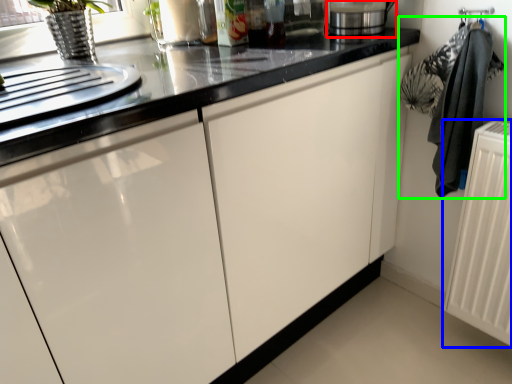
Question: Which object is positioned farthest from appliance (highlighted by a red box)? Select from radiator (highlighted by a blue box) and laundry (highlighted by a green box).

Choices:
 (A) radiator
 (B) laundry

Answer: (A)